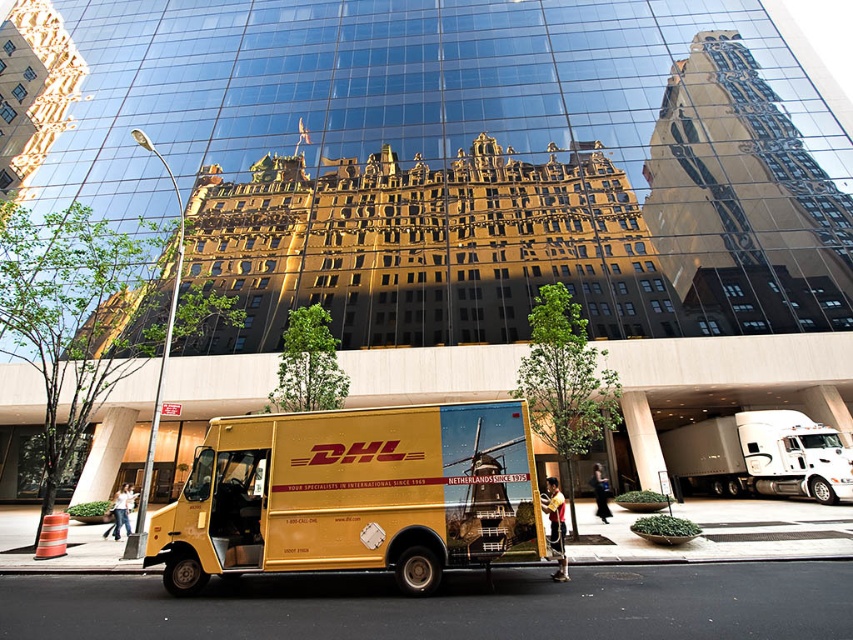
Is point (248, 554) closer to viewer compared to point (752, 433)?

That is True.

Who is shorter, metallic yellow delivery truck at center or white glossy semi-truck at lower right?

white glossy semi-truck at lower right is shorter.

Does point (531, 554) come closer to viewer compared to point (717, 436)?

Yes.

Locate an element on the screen. metallic yellow delivery truck at center is located at coordinates (354, 496).